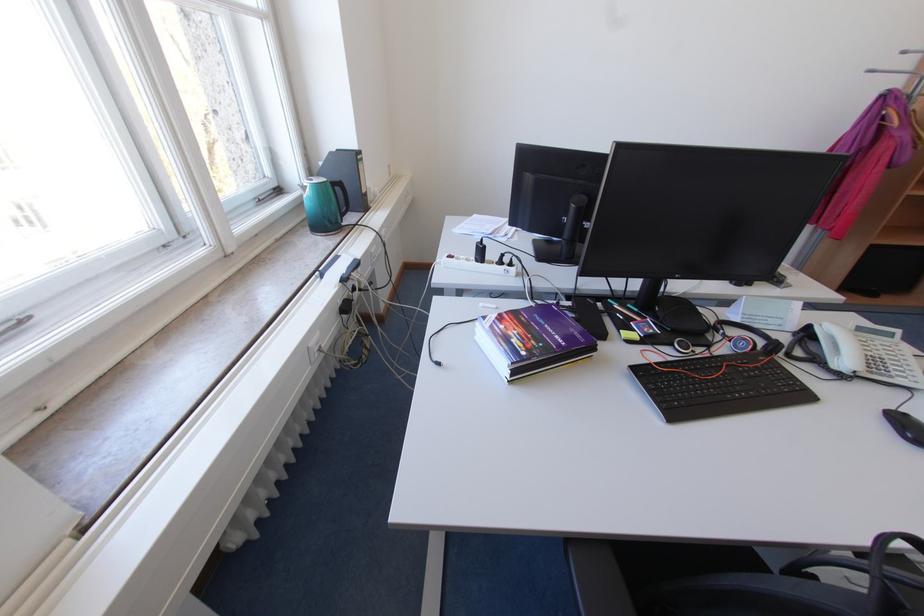
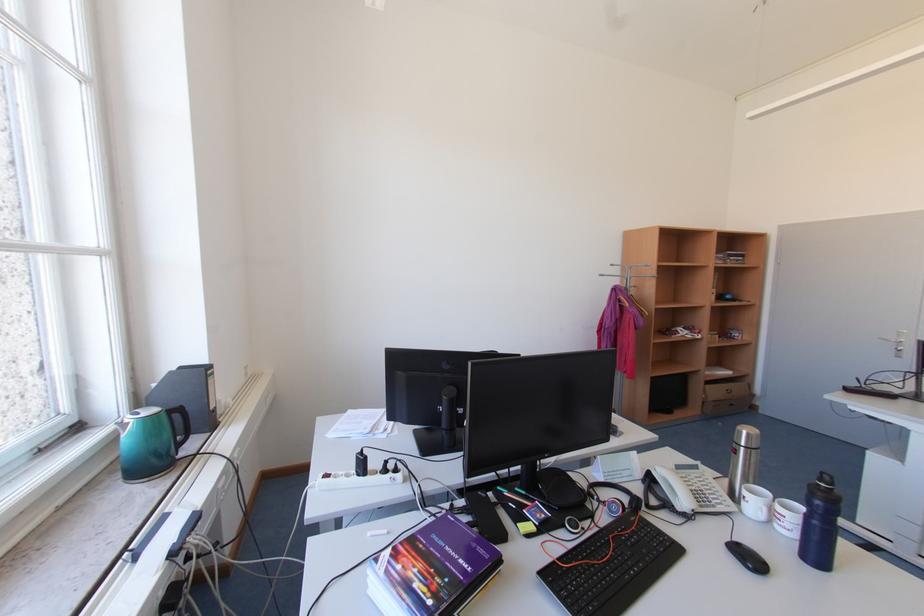
Find the pixel in the second image that matches point (888, 69) in the first image.

(613, 275)